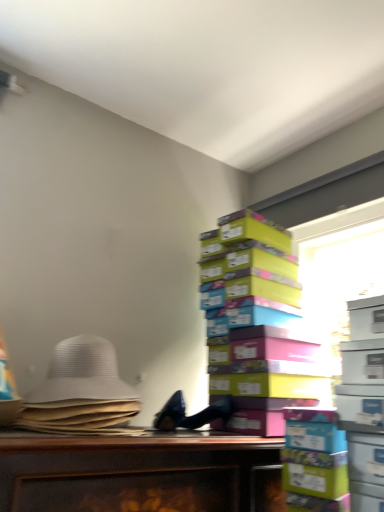
Image resolution: width=384 pixels, height=512 pixels. Describe the element at coordinates (80, 390) in the screenshot. I see `white fabric hat at left` at that location.

What do you see at coordinates (340, 279) in the screenshot? I see `transparent plastic window screen at upper right` at bounding box center [340, 279].

In order to face transparent plastic window screen at upper right, should I rotate leftwards or rightwards?

You should look right and rotate roughly 19.468 degrees.

Identify the location of white fabric hat at left. The height and width of the screenshot is (512, 384). (80, 390).

Looking at this image, from a real-world perspective, who is located higher, white fabric hat at left or multicolored cardboard boxes at right?

In real-world perspective, multicolored cardboard boxes at right is above.

Is white fabric hat at left far from multicolored cardboard boxes at right?

white fabric hat at left is actually quite close to multicolored cardboard boxes at right.

From the image's perspective, is white fabric hat at left over multicolored cardboard boxes at right?

Actually, white fabric hat at left appears below multicolored cardboard boxes at right in the image.

In the scene shown: Is white fabric hat at left at the left side of multicolored cardboard boxes at right?

Correct, you'll find white fabric hat at left to the left of multicolored cardboard boxes at right.

Is point (284, 426) less distant than point (381, 264)?

Yes, it is.

Is multicolored cardboard boxes at right to the left of transparent plastic window screen at upper right from the viewer's perspective?

Yes.

At what (x,y) coordinates should I click in order to perform the action: click on window screen behind the multicolored cardboard boxes at right. Please return your answer as a coordinate pair (x, y). The image size is (384, 512). Looking at the image, I should click on (340, 279).

Is white fabric hat at left to the left or to the right of transparent plastic window screen at upper right in the image?

Based on their positions, white fabric hat at left is located to the left of transparent plastic window screen at upper right.

From the picture: From the image's perspective, between white fabric hat at left and transparent plastic window screen at upper right, who is located below?

white fabric hat at left appears lower in the image.

Between white fabric hat at left and transparent plastic window screen at upper right, which one has smaller width?

transparent plastic window screen at upper right is thinner.

Is point (305, 275) behind point (256, 249)?

Yes, it is behind point (256, 249).

From a real-world perspective, which object stands above the other?

transparent plastic window screen at upper right.

This screenshot has height=512, width=384. Find the location of `window screen that is above the multicolored cardboard boxes at right (from the image's perspective)`. window screen that is above the multicolored cardboard boxes at right (from the image's perspective) is located at coordinates (340, 279).

Can you confirm if transparent plastic window screen at upper right is wider than multicolored cardboard boxes at right?

No.

Does point (263, 244) lie behind point (68, 417)?

Yes, it is behind point (68, 417).

From a real-world perspective, which object stands above the other?

multicolored cardboard boxes at right.

Considering the relative sizes of multicolored cardboard boxes at right and white fabric hat at left in the image provided, is multicolored cardboard boxes at right taller than white fabric hat at left?

Yes.

Image resolution: width=384 pixels, height=512 pixels. In the image, there is a multicolored cardboard boxes at right. What are the coordinates of `wide below it (from a real-world perspective)` in the screenshot? It's located at (80, 390).

Is transparent plastic window screen at upper right positioned far away from white fabric hat at left?

Actually, transparent plastic window screen at upper right and white fabric hat at left are a little close together.

The image size is (384, 512). In order to click on window screen above the white fabric hat at left (from a real-world perspective) in this screenshot , I will do `click(340, 279)`.

Considering the relative sizes of transparent plastic window screen at upper right and white fabric hat at left in the image provided, is transparent plastic window screen at upper right taller than white fabric hat at left?

Yes, transparent plastic window screen at upper right is taller than white fabric hat at left.

In the scene shown: From a real-world perspective, is transparent plastic window screen at upper right under white fabric hat at left?

No, from a real-world perspective, transparent plastic window screen at upper right is not below white fabric hat at left.

At what (x,y) coordinates should I click in order to perform the action: click on wide directly beneath the multicolored cardboard boxes at right (from a real-world perspective). Please return your answer as a coordinate pair (x, y). Looking at the image, I should click on (80, 390).

Image resolution: width=384 pixels, height=512 pixels. What are the coordinates of `window screen on the right of the multicolored cardboard boxes at right` in the screenshot? It's located at (340, 279).

Estimate the real-world distances between objects in this image. Which object is closer to multicolored cardboard boxes at right, transparent plastic window screen at upper right or white fabric hat at left?

transparent plastic window screen at upper right is closer to multicolored cardboard boxes at right.

When comparing their distances from white fabric hat at left, does multicolored cardboard boxes at right or transparent plastic window screen at upper right seem closer?

multicolored cardboard boxes at right is positioned closer to the anchor white fabric hat at left.

Based on their spatial positions, is white fabric hat at left or multicolored cardboard boxes at right closer to transparent plastic window screen at upper right?

multicolored cardboard boxes at right is closer to transparent plastic window screen at upper right.

Based on their spatial positions, is transparent plastic window screen at upper right or multicolored cardboard boxes at right further from white fabric hat at left?

transparent plastic window screen at upper right is further to white fabric hat at left.

Which object lies nearer to the anchor point multicolored cardboard boxes at right, white fabric hat at left or transparent plastic window screen at upper right?

The object closer to multicolored cardboard boxes at right is transparent plastic window screen at upper right.

Looking at the image, which one is located closer to transparent plastic window screen at upper right, multicolored cardboard boxes at right or white fabric hat at left?

Among the two, multicolored cardboard boxes at right is located nearer to transparent plastic window screen at upper right.

Where is `book between white fabric hat at left and transparent plastic window screen at upper right from left to right`? This screenshot has width=384, height=512. book between white fabric hat at left and transparent plastic window screen at upper right from left to right is located at coordinates (258, 324).